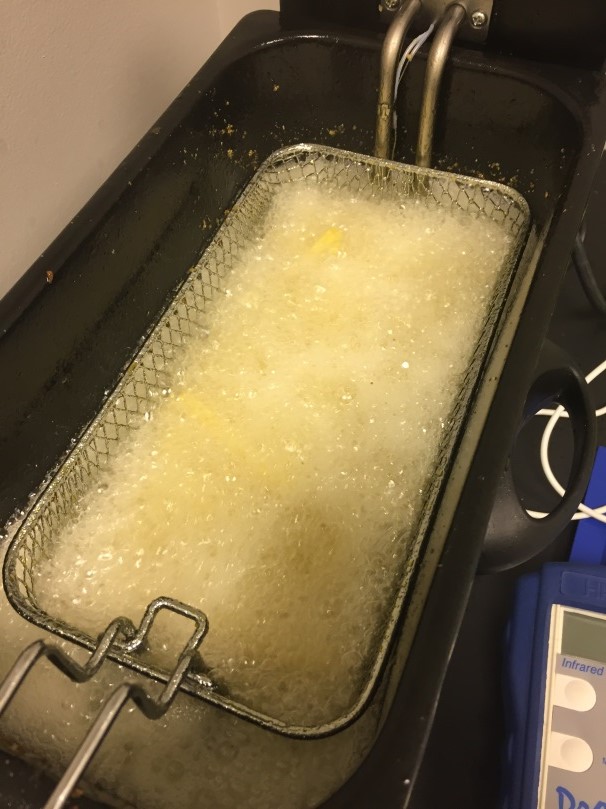
In order to click on wires in this screenshot , I will do `click(48, 515)`.